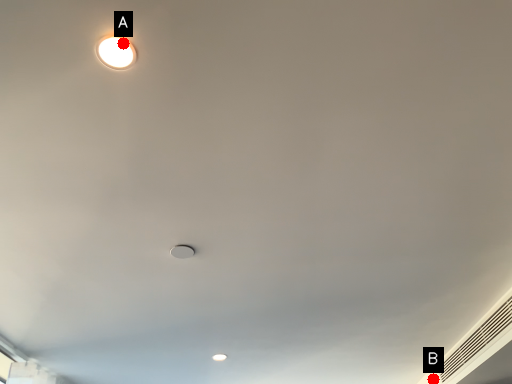
Question: Two points are circled on the image, labeled by A and B beside each circle. Which point is farther to the camera?

Choices:
 (A) A is further
 (B) B is further

Answer: (B)